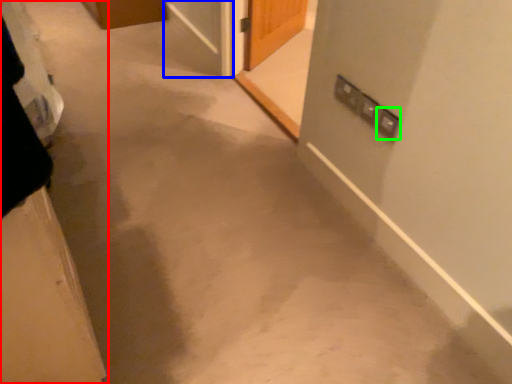
Question: Which is nearer to the door (highlighted by a red box)? screen door (highlighted by a blue box) or electric outlet (highlighted by a green box).

Choices:
 (A) screen door
 (B) electric outlet

Answer: (B)